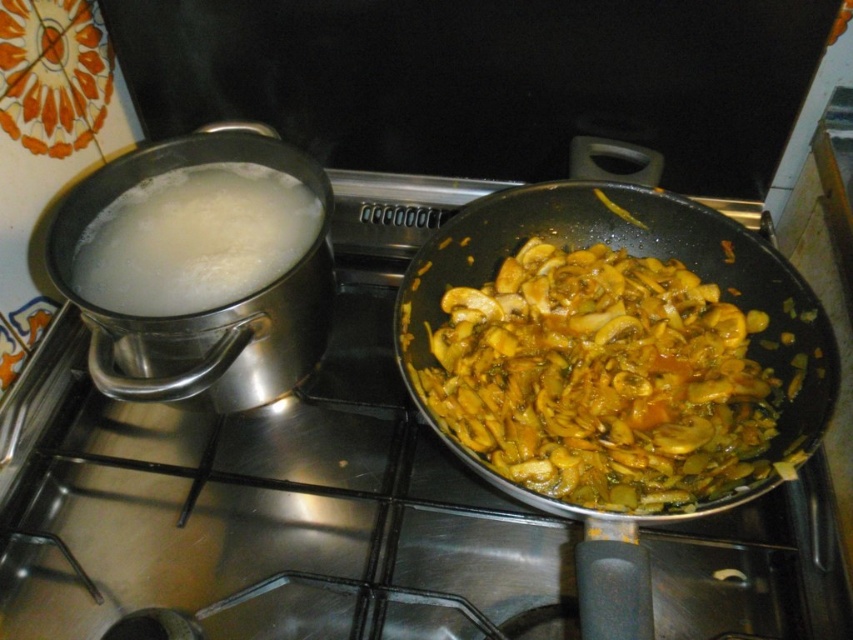
You are a chef preparing a dish and need to identify the ingredients in the center of the stove. Looking at the image, what is located at the point with coordinates [602,380]?

The point at coordinates [602,380] corresponds to yellowish brown saut e mushrooms at center right.

You are a chef standing in front of the stove. You need to reach for the point at coordinates point (579, 557). Your arm can extend 20 inches. Can you reach it?

The point (579, 557) is 21.17 inches away from the camera, so no, you cannot reach it with an arm that extends only 20 inches.